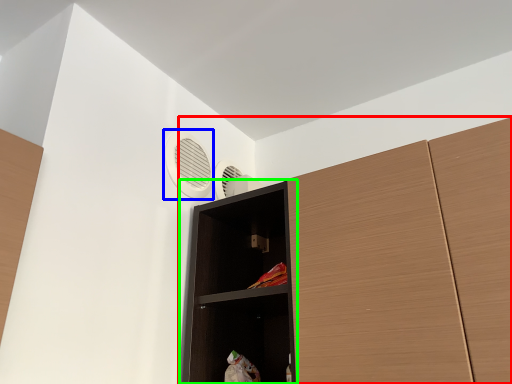
Question: Based on their relative distances, which object is farther from cupboard (highlighted by a red box)? Choose from air conditioning (highlighted by a blue box) and shelf (highlighted by a green box).

Choices:
 (A) air conditioning
 (B) shelf

Answer: (A)